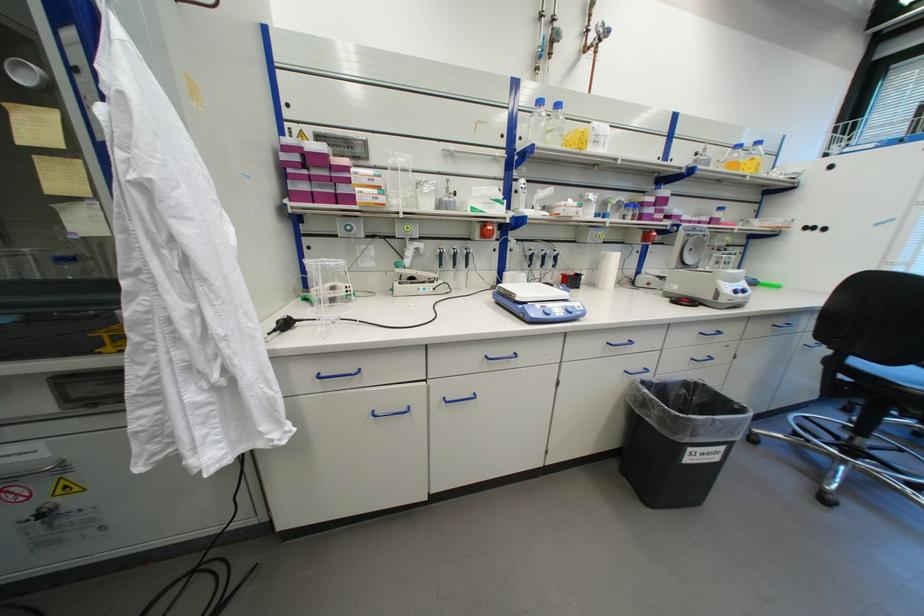
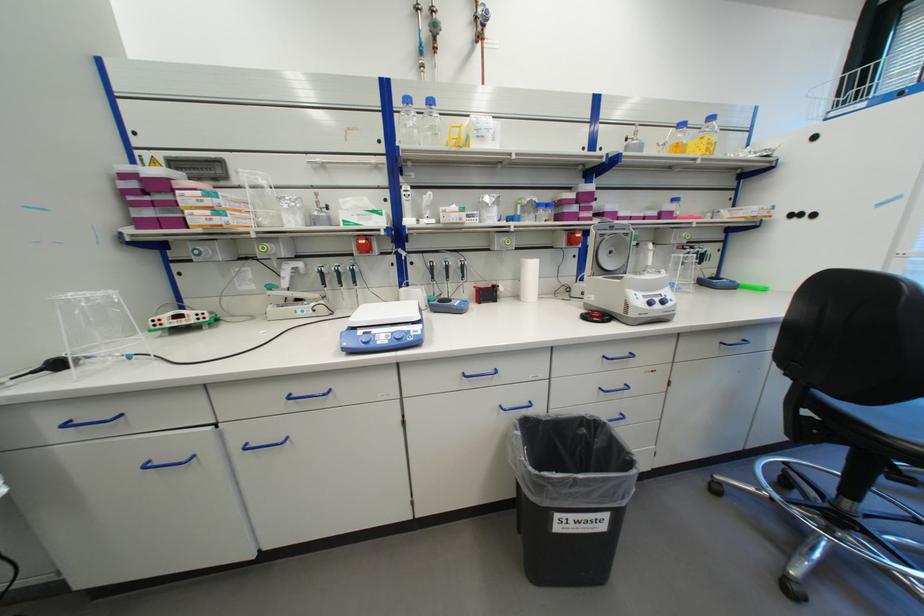
The point at (556, 105) is marked in the first image. Where is the corresponding point in the second image?

(428, 103)